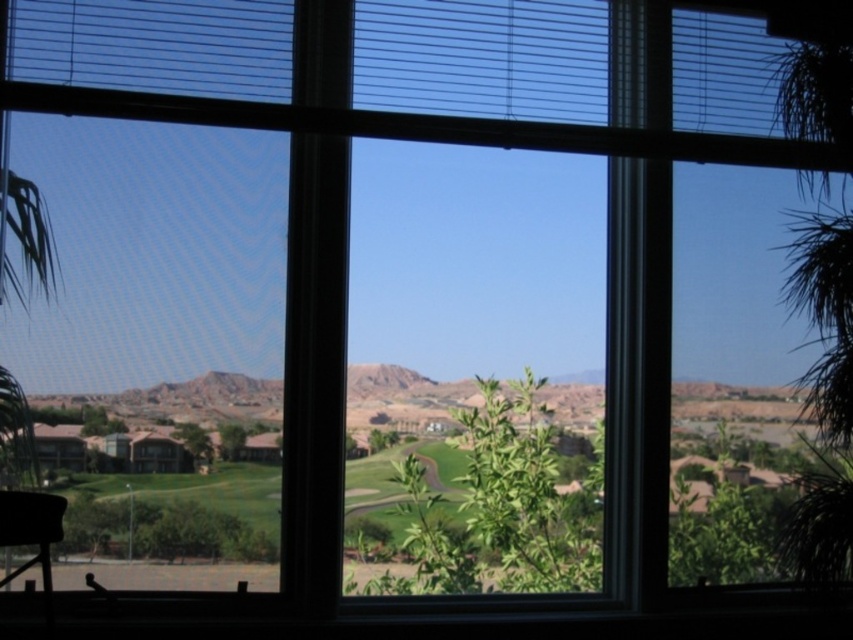
You are an interior designer planning to place a new sofa in the room. The sofa is 1.5 meters wide. You see the desert sandstone mountain at center and the matte black chair at lower left. Can the sofa fit between these two objects without overlapping them?

The desert sandstone mountain at center is wider than the matte black chair at lower left. However, the exact distance between them isn not provided. To determine if the sofa can fit, measure the space between the desert sandstone mountain at center and the matte black chair at lower left. If the gap is at least 1.5 meters, the sofa will fit.

You are designing a virtual reality scene and want to ensure the desert sandstone mountain at center and the matte black chair at lower left are scaled appropriately. Based on the image, which object should be made larger in the VR environment?

The desert sandstone mountain at center should be made larger in the VR environment because it is bigger than the matte black chair at lower left according to the description.

Looking at this image, you are standing inside a room and looking through the window. You see the desert sandstone mountain at center and the matte black chair at lower left. Which object is closer to you?

The matte black chair at lower left is closer to you because it is positioned in the foreground, while the desert sandstone mountain at center is further away in the background.